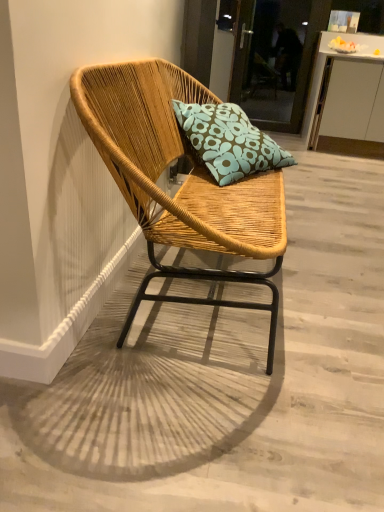
Question: Considering the relative positions of transparent glass door at upper center and teal floral cushion at center in the image provided, is transparent glass door at upper center behind teal floral cushion at center?

Choices:
 (A) yes
 (B) no

Answer: (A)

Question: Can you confirm if transparent glass door at upper center is positioned to the right of teal floral cushion at center?

Choices:
 (A) no
 (B) yes

Answer: (B)

Question: Is transparent glass door at upper center taller than teal floral cushion at center?

Choices:
 (A) no
 (B) yes

Answer: (B)

Question: Is transparent glass door at upper center positioned with its back to teal floral cushion at center?

Choices:
 (A) yes
 (B) no

Answer: (B)

Question: Can you confirm if transparent glass door at upper center is thinner than teal floral cushion at center?

Choices:
 (A) no
 (B) yes

Answer: (B)

Question: Does transparent glass door at upper center contain teal floral cushion at center?

Choices:
 (A) no
 (B) yes

Answer: (A)

Question: Can you confirm if teal floral cushion at center is taller than white glossy cabinet at upper right?

Choices:
 (A) yes
 (B) no

Answer: (B)

Question: Is teal floral cushion at center positioned behind white glossy cabinet at upper right?

Choices:
 (A) no
 (B) yes

Answer: (A)

Question: Is teal floral cushion at center next to white glossy cabinet at upper right and touching it?

Choices:
 (A) no
 (B) yes

Answer: (A)

Question: Does teal floral cushion at center turn towards white glossy cabinet at upper right?

Choices:
 (A) yes
 (B) no

Answer: (B)

Question: From a real-world perspective, is teal floral cushion at center positioned under white glossy cabinet at upper right based on gravity?

Choices:
 (A) no
 (B) yes

Answer: (A)

Question: Is teal floral cushion at center wider than white glossy cabinet at upper right?

Choices:
 (A) yes
 (B) no

Answer: (B)

Question: Is the depth of transparent glass door at upper center less than that of natural wood chair at center?

Choices:
 (A) no
 (B) yes

Answer: (A)